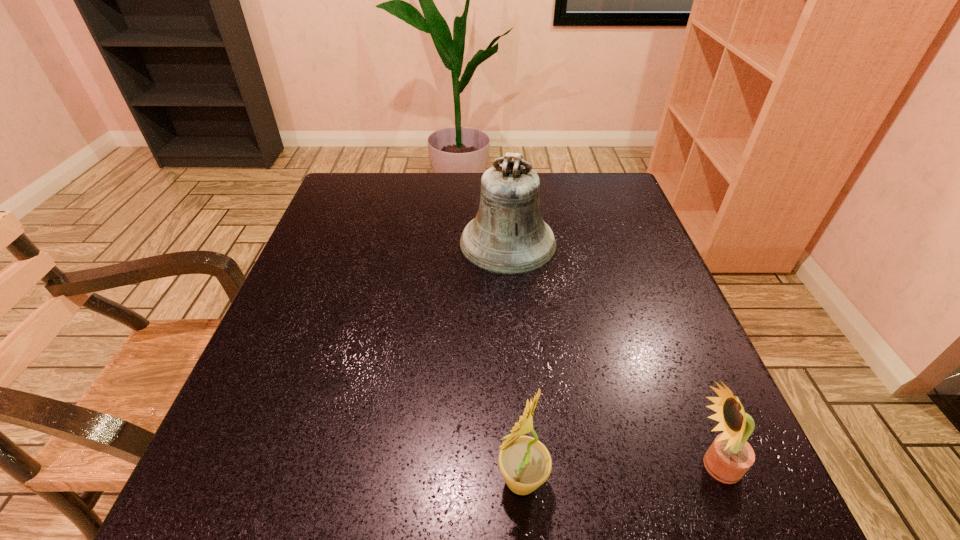
Identify the location of bell. The width and height of the screenshot is (960, 540). tap(508, 236).

The width and height of the screenshot is (960, 540). I want to click on the left sunflower, so click(x=525, y=463).

Find the location of a particular element. The height and width of the screenshot is (540, 960). the rightmost object is located at coordinates (730, 456).

Identify the location of free location located on the left of the bell. This screenshot has height=540, width=960. (341, 242).

The image size is (960, 540). I want to click on vacant space situated on the face of the left sunflower, so click(363, 480).

Locate an element on the screen. The height and width of the screenshot is (540, 960). free point located 0.380m on the face of the left sunflower is located at coordinates (230, 480).

Where is `vacant space located on the face of the left sunflower`? This screenshot has height=540, width=960. vacant space located on the face of the left sunflower is located at coordinates (321, 480).

I want to click on vacant space situated on the face of the rightmost object, so click(512, 466).

Image resolution: width=960 pixels, height=540 pixels. Identify the location of free location located on the face of the rightmost object. (545, 466).

What are the coordinates of `vacant position located on the face of the rightmost object` in the screenshot? It's located at (587, 466).